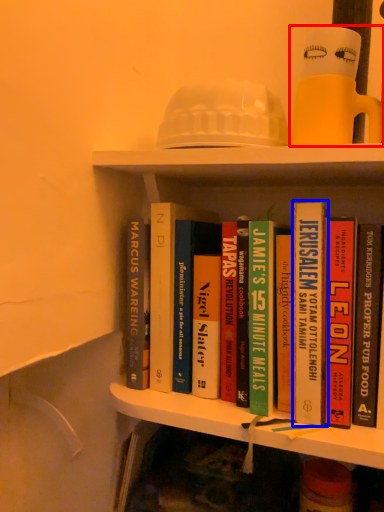
Question: Which of the following is the closest to the observer, toy (highlighted by a red box) or book (highlighted by a blue box)?

Choices:
 (A) toy
 (B) book

Answer: (A)